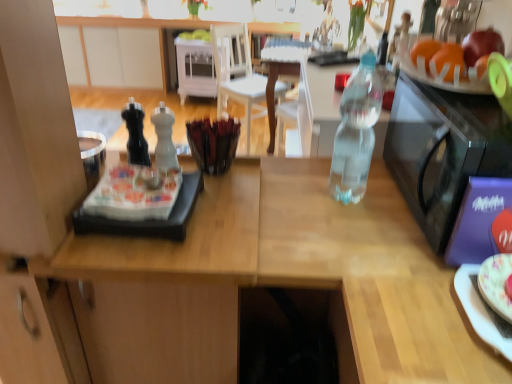
Image resolution: width=512 pixels, height=384 pixels. Identify the location of free space that is in between clear plastic bottle at center, which ranks as the 3th bottle in left-to-right order, and porcelain floral plate at right. (400, 243).